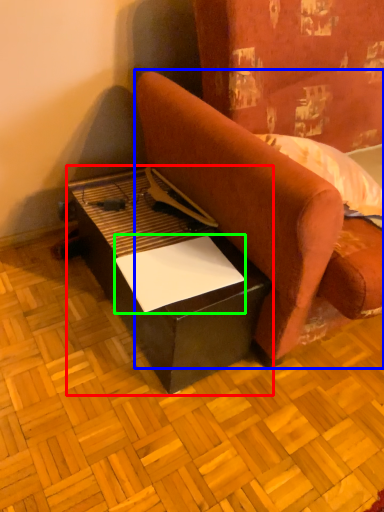
Question: Considering the real-world distances, which object is closest to table (highlighted by a red box)? studio couch (highlighted by a blue box) or paper (highlighted by a green box).

Choices:
 (A) studio couch
 (B) paper

Answer: (B)